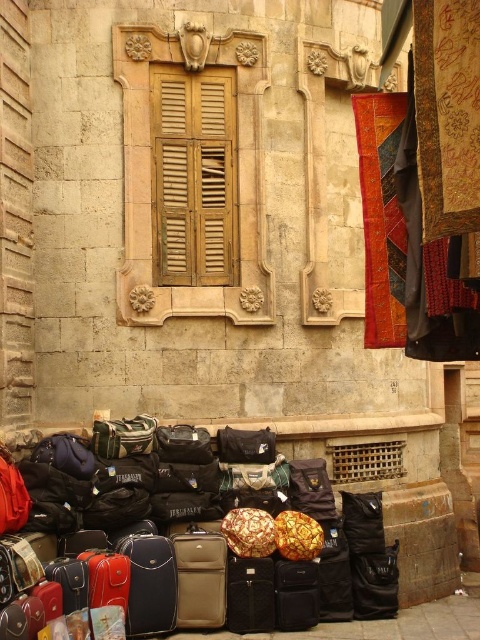
Question: Is matte black suitcase at lower center above wooden at center?

Choices:
 (A) no
 (B) yes

Answer: (A)

Question: Estimate the real-world distances between objects in this image. Which object is farther from the matte black suitcase at lower center?

Choices:
 (A) matte black duffel bag at center
 (B) wooden at center

Answer: (B)

Question: Which object is closer to the camera taking this photo?

Choices:
 (A) matte black suitcase at lower center
 (B) matte black duffel bag at center

Answer: (A)

Question: From the image, what is the correct spatial relationship of matte black suitcase at lower center in relation to matte black duffel bag at center?

Choices:
 (A) below
 (B) above

Answer: (A)

Question: Does matte black suitcase at lower center appear on the right side of matte black duffel bag at center?

Choices:
 (A) no
 (B) yes

Answer: (A)

Question: Which point is farther from the camera taking this photo?

Choices:
 (A) (249, 436)
 (B) (212, 88)

Answer: (B)